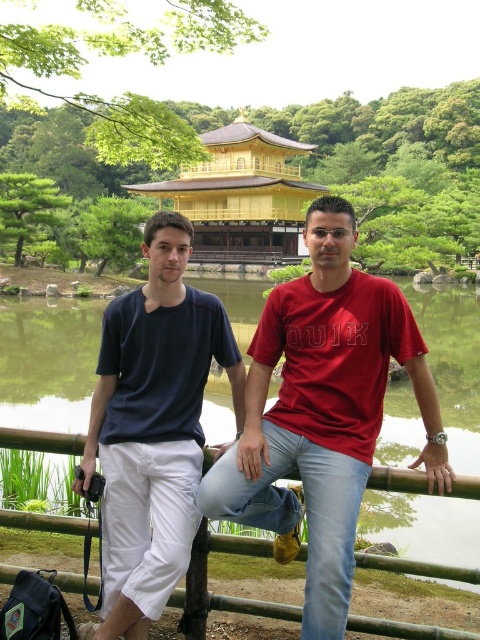
Question: Which object appears closest to the camera in this image?

Choices:
 (A) gold/golden/temple at center
 (B) dark blue cotton t-shirt at center
 (C) matte red t-shirt at center

Answer: (C)

Question: Does dark blue cotton t-shirt at center appear over gold/golden/temple at center?

Choices:
 (A) no
 (B) yes

Answer: (A)

Question: Can you confirm if dark blue cotton t-shirt at center is positioned to the left of gold/golden/temple at center?

Choices:
 (A) yes
 (B) no

Answer: (B)

Question: Is matte red t-shirt at center to the right of dark blue cotton t-shirt at center from the viewer's perspective?

Choices:
 (A) yes
 (B) no

Answer: (A)

Question: Which object is farther from the camera taking this photo?

Choices:
 (A) matte red t-shirt at center
 (B) gold/golden/temple at center

Answer: (B)

Question: Which object is closer to the camera taking this photo?

Choices:
 (A) dark blue cotton t-shirt at center
 (B) gold/golden/temple at center
 (C) matte red t-shirt at center

Answer: (C)